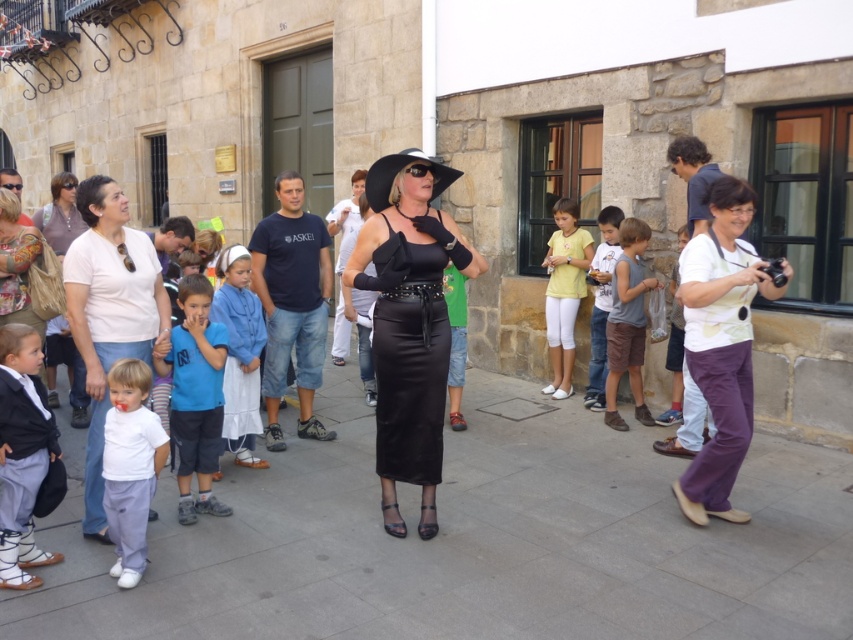
Question: Among these objects, which one is nearest to the camera?

Choices:
 (A) blue cotton shirt at center
 (B) light yellow fabric camera at right
 (C) white matte shirt at left
 (D) blue cotton dress at center

Answer: (C)

Question: Which object is the closest to the white matte shirt at left?

Choices:
 (A) black leather dress at center
 (B) blue cotton shirt at center

Answer: (B)

Question: Can you confirm if gray concrete pavement at center is positioned below light blue denim shorts at right?

Choices:
 (A) no
 (B) yes

Answer: (B)

Question: Which object is the farthest from the light yellow fabric camera at right?

Choices:
 (A) blue cotton shirt at center
 (B) brown cotton shorts at center-right

Answer: (A)

Question: Is light yellow fabric camera at right to the right of black leather dress at center from the viewer's perspective?

Choices:
 (A) no
 (B) yes

Answer: (B)

Question: Does white matte shirt at lower left appear on the left side of yellow cotton shirt at center?

Choices:
 (A) no
 (B) yes

Answer: (B)